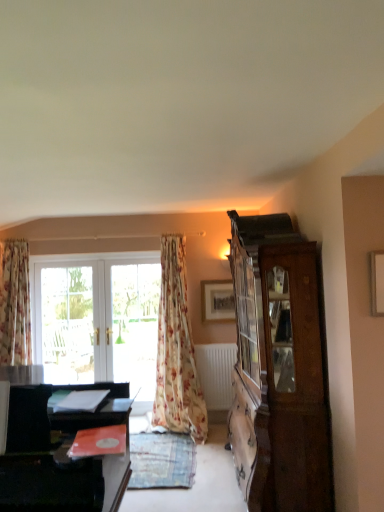
Question: Considering the positions of wooden picture frame at upper center and floral fabric curtain at left, the first curtain positioned from the left, in the image, is wooden picture frame at upper center wider or thinner than floral fabric curtain at left, the first curtain positioned from the left,?

Choices:
 (A) thin
 (B) wide

Answer: (A)

Question: Is point (205, 287) positioned closer to the camera than point (11, 362)?

Choices:
 (A) farther
 (B) closer

Answer: (B)

Question: Which object is positioned farthest from the white matte radiator at lower center?

Choices:
 (A) wooden cabinet at right
 (B) wooden picture frame at upper center
 (C) floral fabric curtain at left, which is the 2th curtain from right to left
 (D) black glossy desk at lower left
 (E) white glossy screen door at center

Answer: (D)

Question: Estimate the real-world distances between objects in this image. Which object is closer to the white matte radiator at lower center?

Choices:
 (A) black glossy desk at lower left
 (B) white glossy screen door at center
 (C) floral fabric curtain at left, the first curtain positioned from the left
 (D) wooden picture frame at upper center
 (E) wooden cabinet at right

Answer: (D)